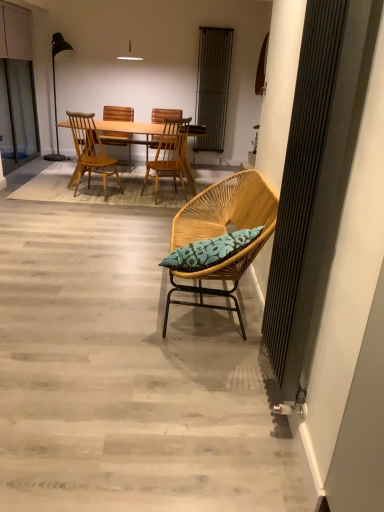
Locate an element on the screen. This screenshot has height=512, width=384. blank space to the left of woven wood chair with blue cushion at center, the 4th chair viewed from the back is located at coordinates (81, 295).